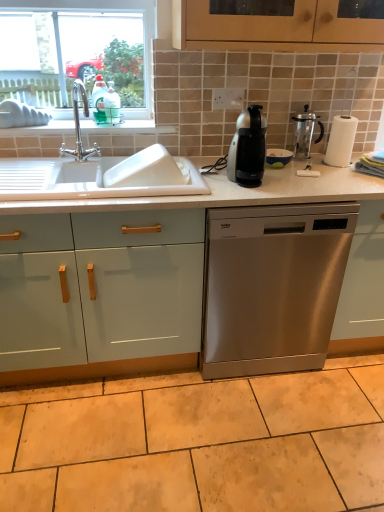
Question: Can you confirm if clear glass window at upper left is positioned to the left of beige ceramic tile at lower center?

Choices:
 (A) yes
 (B) no

Answer: (A)

Question: Does clear glass window at upper left have a lesser width compared to beige ceramic tile at lower center?

Choices:
 (A) yes
 (B) no

Answer: (A)

Question: Is clear glass window at upper left bigger than beige ceramic tile at lower center?

Choices:
 (A) no
 (B) yes

Answer: (A)

Question: From the image's perspective, is clear glass window at upper left located above beige ceramic tile at lower center?

Choices:
 (A) no
 (B) yes

Answer: (B)

Question: Is clear glass window at upper left wider than beige ceramic tile at lower center?

Choices:
 (A) yes
 (B) no

Answer: (B)

Question: In the image, is clear glass window at upper left positioned in front of or behind beige ceramic tile at lower center?

Choices:
 (A) front
 (B) behind

Answer: (B)

Question: From their relative heights in the image, would you say clear glass window at upper left is taller or shorter than beige ceramic tile at lower center?

Choices:
 (A) tall
 (B) short

Answer: (A)

Question: Visually, is clear glass window at upper left positioned to the left or to the right of beige ceramic tile at lower center?

Choices:
 (A) right
 (B) left

Answer: (B)

Question: From the image's perspective, relative to beige ceramic tile at lower center, is clear glass window at upper left above or below?

Choices:
 (A) above
 (B) below

Answer: (A)

Question: From the image's perspective, is stainless steel dishwasher at center located above or below polished chrome faucet at upper left?

Choices:
 (A) below
 (B) above

Answer: (A)

Question: Would you say stainless steel dishwasher at center is to the left or to the right of polished chrome faucet at upper left in the picture?

Choices:
 (A) left
 (B) right

Answer: (B)

Question: In terms of size, does stainless steel dishwasher at center appear bigger or smaller than polished chrome faucet at upper left?

Choices:
 (A) small
 (B) big

Answer: (B)

Question: Would you say stainless steel dishwasher at center is inside or outside polished chrome faucet at upper left?

Choices:
 (A) outside
 (B) inside

Answer: (A)

Question: In terms of width, does beige ceramic tile at lower center look wider or thinner when compared to stainless steel dishwasher at center?

Choices:
 (A) thin
 (B) wide

Answer: (B)

Question: Visually, is beige ceramic tile at lower center positioned to the left or to the right of stainless steel dishwasher at center?

Choices:
 (A) right
 (B) left

Answer: (B)